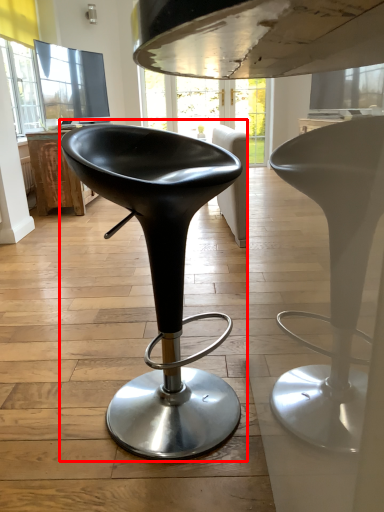
Question: In this image, where is chair (annotated by the red box) located relative to table?

Choices:
 (A) right
 (B) left

Answer: (A)